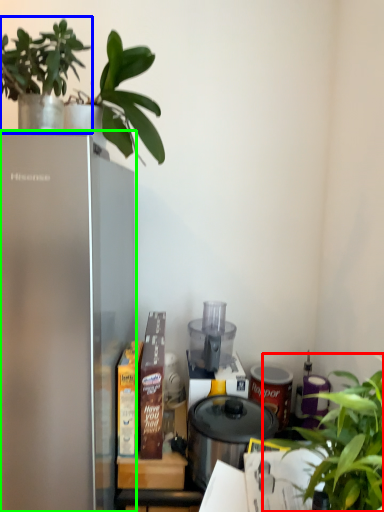
Question: Considering the real-world distances, which object is closest to houseplant (highlighted by a red box)? houseplant (highlighted by a blue box) or refrigerator (highlighted by a green box).

Choices:
 (A) houseplant
 (B) refrigerator

Answer: (B)